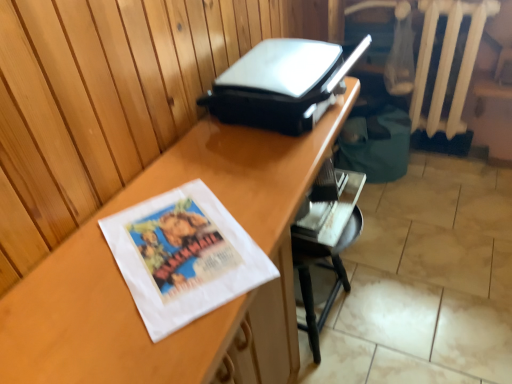
Question: Which is correct: wooden desk at center is inside metallic silver chair at lower right, or outside of it?

Choices:
 (A) inside
 (B) outside

Answer: (B)

Question: From a real-world perspective, is wooden desk at center physically located above or below metallic silver chair at lower right?

Choices:
 (A) below
 (B) above

Answer: (B)

Question: Based on their relative distances, which object is nearer to the white painted wood radiator at upper right?

Choices:
 (A) wooden desk at center
 (B) metallic silver chair at lower right

Answer: (B)

Question: Based on their relative distances, which object is farther from the metallic silver chair at lower right?

Choices:
 (A) wooden desk at center
 (B) white painted wood radiator at upper right

Answer: (B)